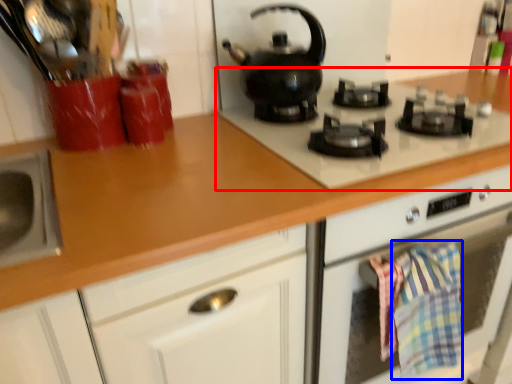
Question: Which point is further to the camera, gas stove (highlighted by a red box) or blanket (highlighted by a blue box)?

Choices:
 (A) gas stove
 (B) blanket

Answer: (B)